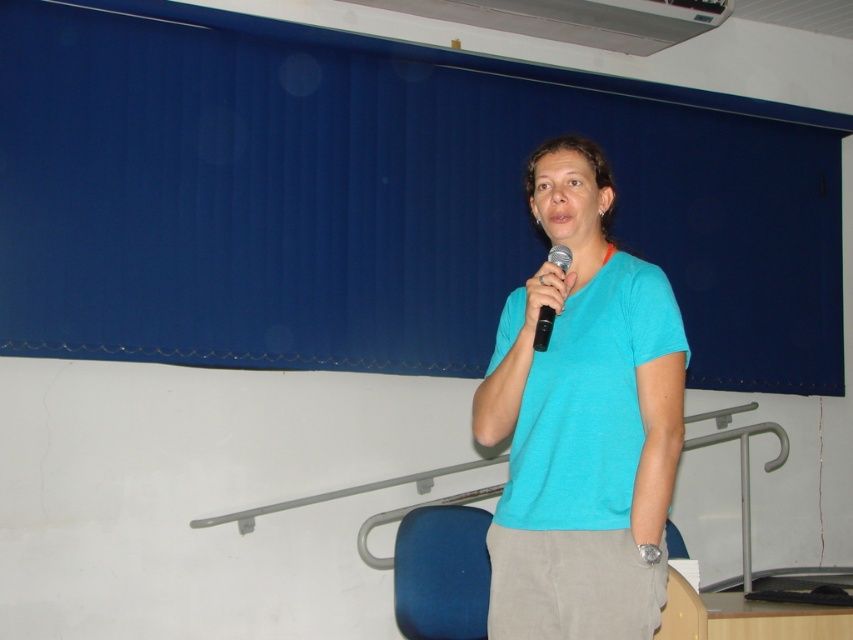
Question: Does matte blue shirt at center appear on the right side of black plastic microphone at center?

Choices:
 (A) yes
 (B) no

Answer: (A)

Question: Considering the relative positions of matte blue shirt at center and black plastic microphone at center in the image provided, where is matte blue shirt at center located with respect to black plastic microphone at center?

Choices:
 (A) right
 (B) left

Answer: (A)

Question: Which object appears closest to the camera in this image?

Choices:
 (A) black plastic microphone at center
 (B) matte blue shirt at center

Answer: (B)

Question: Is matte blue shirt at center bigger than black plastic microphone at center?

Choices:
 (A) no
 (B) yes

Answer: (B)